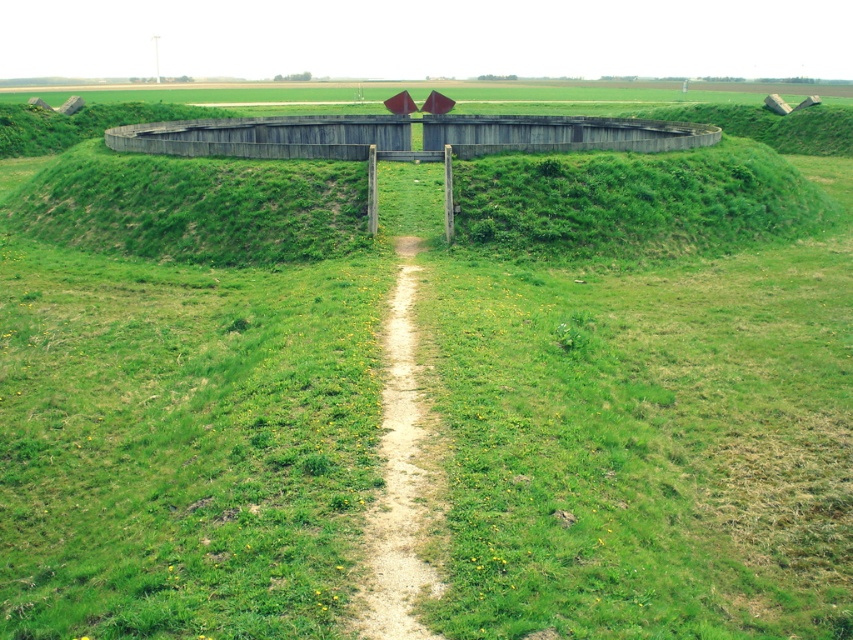
Is point (657, 122) closer to viewer compared to point (434, 515)?

No, (657, 122) is further to viewer.

Who is taller, wooden fence at center or dirt/gravel path at center?

With more height is wooden fence at center.

The image size is (853, 640). What are the coordinates of `wooden fence at center` in the screenshot? It's located at (404, 134).